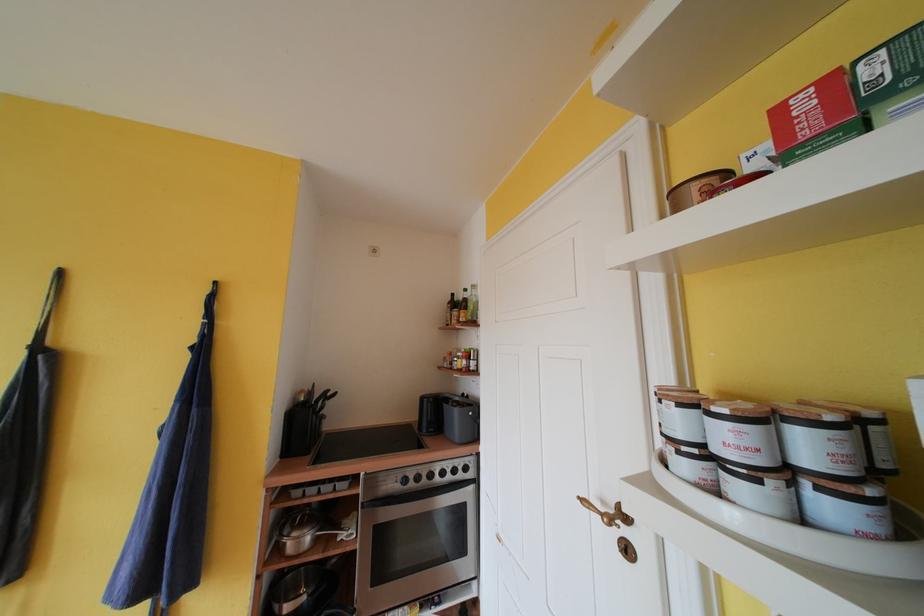
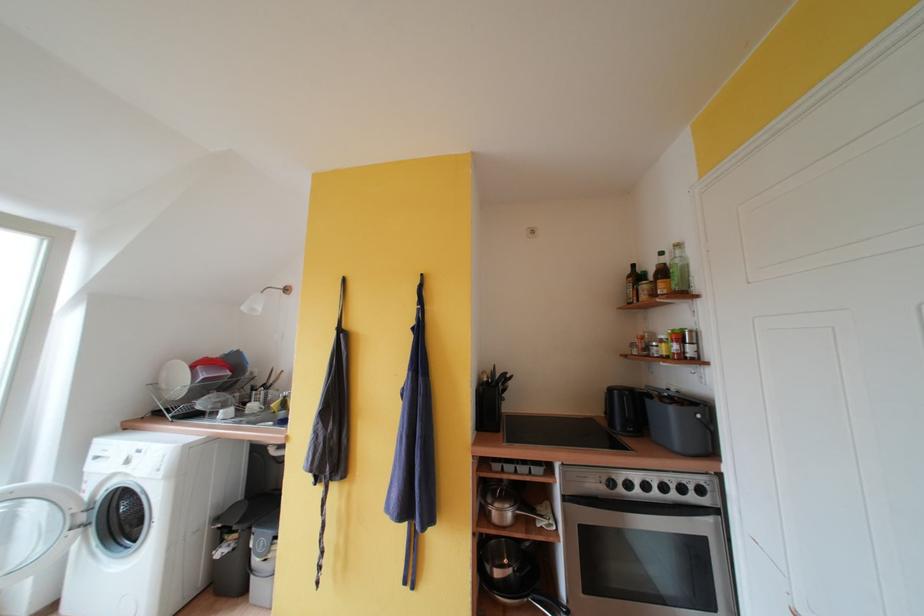
In the second image, find the point that corresponds to the point at 470,365 in the first image.

(682, 350)